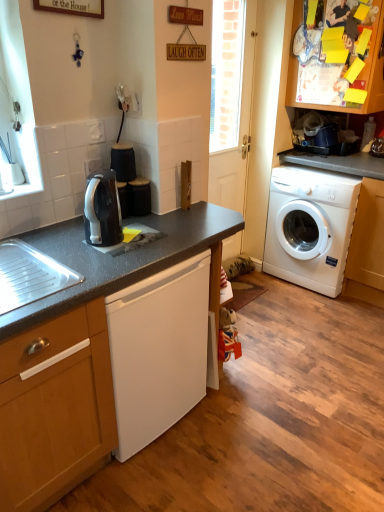
At what (x,y) coordinates should I click in order to perform the action: click on free point to the right of black glossy kettle at upper left. Please return your answer as a coordinate pair (x, y). This screenshot has height=512, width=384. Looking at the image, I should click on (158, 239).